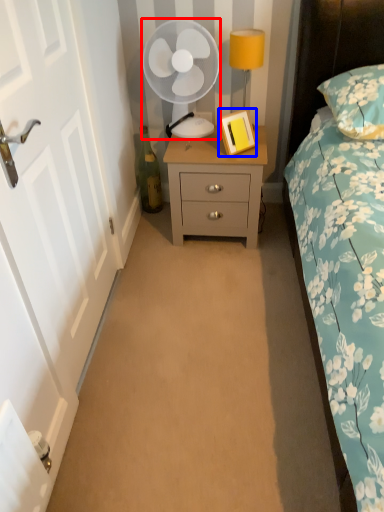
Question: Which of the following is the farthest to the observer, mechanical fan (highlighted by a red box) or picture frame (highlighted by a blue box)?

Choices:
 (A) mechanical fan
 (B) picture frame

Answer: (B)